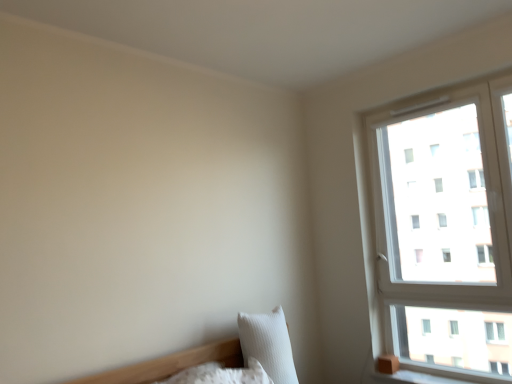
Question: Is white textured pillow at lower right, arranged as the 1th pillow when viewed from the right, smaller than white plastic window at upper right?

Choices:
 (A) no
 (B) yes

Answer: (B)

Question: Does white textured pillow at lower right, positioned as the second pillow in left-to-right order, lie behind white plastic window at upper right?

Choices:
 (A) no
 (B) yes

Answer: (B)

Question: Is white textured pillow at lower right, arranged as the 1th pillow when viewed from the right, taller than white plastic window at upper right?

Choices:
 (A) no
 (B) yes

Answer: (A)

Question: Is white plastic window at upper right a part of white textured pillow at lower right, arranged as the 1th pillow when viewed from the right?

Choices:
 (A) yes
 (B) no

Answer: (B)

Question: Are white textured pillow at lower right, positioned as the second pillow in left-to-right order, and white plastic window at upper right beside each other?

Choices:
 (A) no
 (B) yes

Answer: (A)

Question: From a real-world perspective, is white textured pillow at lower right, positioned as the second pillow in left-to-right order, above or below white plastic window at upper right?

Choices:
 (A) below
 (B) above

Answer: (A)

Question: From the image's perspective, relative to white plastic window at upper right, is white textured pillow at lower right, arranged as the 1th pillow when viewed from the right, above or below?

Choices:
 (A) above
 (B) below

Answer: (B)

Question: Is white textured pillow at lower right, positioned as the second pillow in left-to-right order, taller or shorter than white plastic window at upper right?

Choices:
 (A) tall
 (B) short

Answer: (B)

Question: Is white textured pillow at lower right, arranged as the 1th pillow when viewed from the right, situated inside white plastic window at upper right or outside?

Choices:
 (A) inside
 (B) outside

Answer: (B)

Question: Considering the positions of white plastic window at upper right and white soft pillow at lower left, arranged as the first pillow when viewed from the left, in the image, is white plastic window at upper right bigger or smaller than white soft pillow at lower left, arranged as the first pillow when viewed from the left,?

Choices:
 (A) small
 (B) big

Answer: (B)

Question: Relative to white soft pillow at lower left, which is the 2th pillow in right-to-left order, is white plastic window at upper right in front or behind?

Choices:
 (A) behind
 (B) front

Answer: (A)

Question: Based on their positions, is white plastic window at upper right located to the left or right of white soft pillow at lower left, arranged as the first pillow when viewed from the left?

Choices:
 (A) right
 (B) left

Answer: (A)

Question: From their relative heights in the image, would you say white plastic window at upper right is taller or shorter than white soft pillow at lower left, arranged as the first pillow when viewed from the left?

Choices:
 (A) short
 (B) tall

Answer: (B)

Question: Would you say white textured pillow at lower right, arranged as the 1th pillow when viewed from the right, is to the left or to the right of white soft pillow at lower left, arranged as the first pillow when viewed from the left, in the picture?

Choices:
 (A) left
 (B) right

Answer: (B)

Question: From the image's perspective, is white textured pillow at lower right, positioned as the second pillow in left-to-right order, located above or below white soft pillow at lower left, which is the 2th pillow in right-to-left order?

Choices:
 (A) above
 (B) below

Answer: (A)